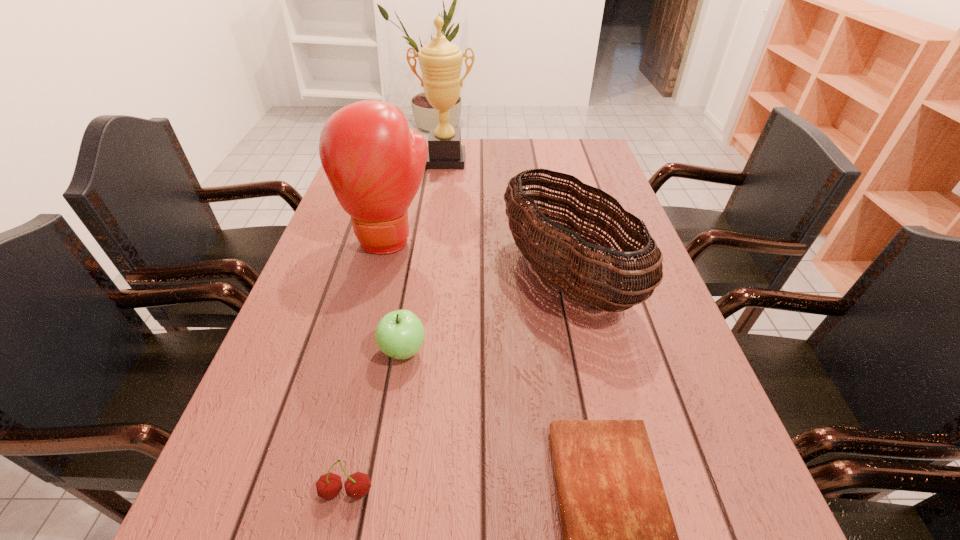
Where is `object that is at the far edge`? Image resolution: width=960 pixels, height=540 pixels. object that is at the far edge is located at coordinates (440, 61).

Where is `object that is positioned at the left edge`? This screenshot has width=960, height=540. object that is positioned at the left edge is located at coordinates (375, 165).

I want to click on object that is at the right edge, so click(569, 267).

Image resolution: width=960 pixels, height=540 pixels. I want to click on vacant space at the far edge, so click(476, 159).

In the image, there is a desktop. At what (x,y) coordinates should I click in order to perform the action: click on vacant area at the left edge. Please return your answer as a coordinate pair (x, y). The image size is (960, 540). Looking at the image, I should click on (339, 245).

Where is `free space at the right edge of the desktop`? Image resolution: width=960 pixels, height=540 pixels. free space at the right edge of the desktop is located at coordinates (654, 414).

Find the location of a particular element. Image resolution: width=960 pixels, height=540 pixels. empty location between the trophy cup and the fourth shortest object is located at coordinates (506, 219).

This screenshot has width=960, height=540. Identify the location of vacant space that's between the boxing glove and the cherry. (368, 366).

Locate an element on the screen. This screenshot has height=540, width=960. free space that is in between the basket and the cherry is located at coordinates (456, 384).

Locate an element on the screen. The height and width of the screenshot is (540, 960). free spot between the farthest object and the basket is located at coordinates (506, 219).